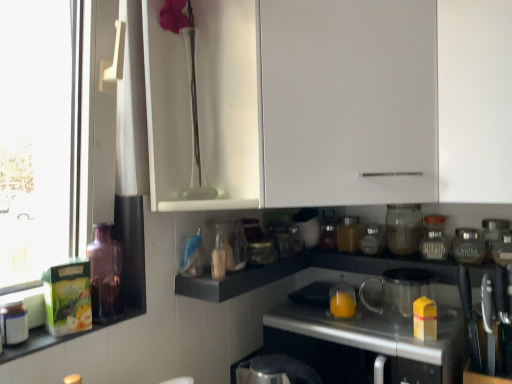
Question: Is matte glass jar at center-right, positioned as the fourth bottle in front-to-back order, shorter than metallic silver kettle at lower center, which appears as the first appliance when viewed from the left?

Choices:
 (A) no
 (B) yes

Answer: (B)

Question: Is matte glass jar at center-right, acting as the third bottle starting from the back, at the right side of metallic silver kettle at lower center, which appears as the first appliance when viewed from the left?

Choices:
 (A) yes
 (B) no

Answer: (A)

Question: Is matte glass jar at center-right, which appears as the second bottle when viewed from the right, positioned with its back to metallic silver kettle at lower center, positioned as the 6th appliance in right-to-left order?

Choices:
 (A) no
 (B) yes

Answer: (A)

Question: Would you say matte glass jar at center-right, which appears as the second bottle when viewed from the right, is outside metallic silver kettle at lower center, positioned as the 6th appliance in right-to-left order?

Choices:
 (A) yes
 (B) no

Answer: (A)

Question: Is matte glass jar at center-right, positioned as the fourth bottle in front-to-back order, to the left of metallic silver kettle at lower center, positioned as the 6th appliance in right-to-left order, from the viewer's perspective?

Choices:
 (A) yes
 (B) no

Answer: (B)

Question: Could you tell me if matte glass jar at center-right, which appears as the second bottle when viewed from the right, is turned towards metallic silver kettle at lower center, which appears as the first appliance when viewed from the left?

Choices:
 (A) no
 (B) yes

Answer: (A)

Question: Does black matte shelf at center appear on the right side of white glossy jar at center, the 5th appliance viewed from the right?

Choices:
 (A) no
 (B) yes

Answer: (A)

Question: From a real-world perspective, is black matte shelf at center beneath white glossy jar at center, the 5th appliance viewed from the right?

Choices:
 (A) no
 (B) yes

Answer: (B)

Question: From the image's perspective, is black matte shelf at center located above white glossy jar at center, the 5th appliance viewed from the right?

Choices:
 (A) no
 (B) yes

Answer: (A)

Question: Does black matte shelf at center have a lesser height compared to white glossy jar at center, which is the 2th appliance from left to right?

Choices:
 (A) yes
 (B) no

Answer: (A)

Question: Is black matte shelf at center not inside white glossy jar at center, which is the 2th appliance from left to right?

Choices:
 (A) yes
 (B) no

Answer: (A)

Question: Is black matte shelf at center placed right next to white glossy jar at center, the 5th appliance viewed from the right?

Choices:
 (A) yes
 (B) no

Answer: (B)

Question: Is the position of translucent glass bottle at left, placed as the 5th bottle when sorted from right to left, less distant than that of white glossy jar at center, the 5th appliance viewed from the right?

Choices:
 (A) yes
 (B) no

Answer: (A)